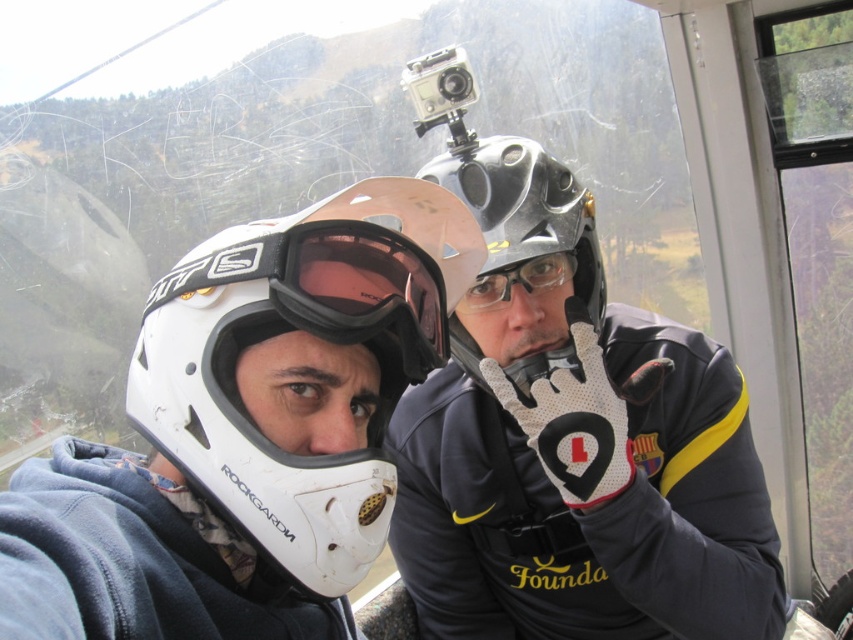
You are a designer trying to create a scale model of the helmets seen in the cable car scene. Given that the metallic gray helmet at center is 20 cm wide in real life, what should be the width of the metallic silver helmet at upper right in your model if you maintain the same scale?

The metallic silver helmet at upper right is wider than the metallic gray helmet at center. Since the metallic gray helmet at center is 20 cm wide, the metallic silver helmet at upper right should be proportionally wider in the model to maintain scale.

You are designing a safety checklist for a cable car ride. You need to ensure that the metallic gray helmet at center and the transparent plastic goggles at center are properly fitted. Which one requires a more precise size adjustment to ensure a secure fit?

The transparent plastic goggles at center require a more precise size adjustment because they are smaller than the metallic gray helmet at center and need to fit snugly around the eyes to ensure proper protection and visibility.

You are a safety inspector checking the cable car. You notice two helmets inside. Which helmet, the metallic silver helmet at upper right or the metallic gray helmet at center, has a larger size?

The metallic silver helmet at upper right is bigger than the metallic gray helmet at center according to the description.